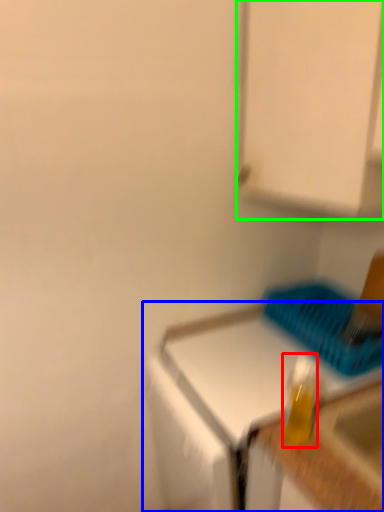
Question: Which object is the closest to the bottle (highlighted by a red box)? Choose among these: countertop (highlighted by a blue box) or cabinetry (highlighted by a green box).

Choices:
 (A) countertop
 (B) cabinetry

Answer: (A)